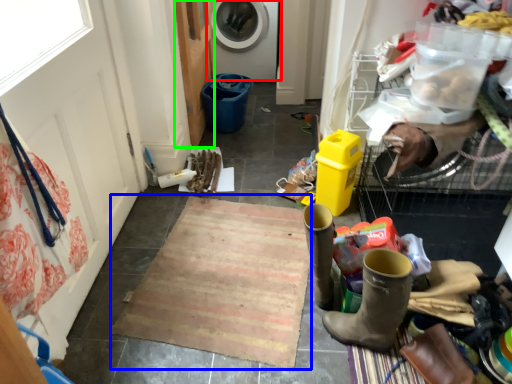
Question: Which object is positioned farthest from washing machine (highlighted by a red box)? Select from doormat (highlighted by a blue box) and screen door (highlighted by a green box).

Choices:
 (A) doormat
 (B) screen door

Answer: (A)